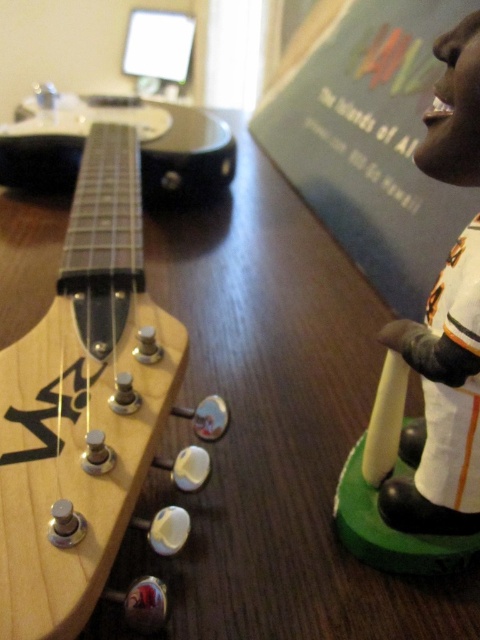
Between natural wood guitar headstock at center-left and white plastic bobblehead at right, which one is positioned lower?

white plastic bobblehead at right

Is point (17, 634) positioned before point (442, 145)?

Yes, point (17, 634) is in front of point (442, 145).

Which is in front, point (178, 538) or point (454, 525)?

Point (178, 538) is more forward.

Where is `natural wood guitar headstock at center-left`? natural wood guitar headstock at center-left is located at coordinates (87, 404).